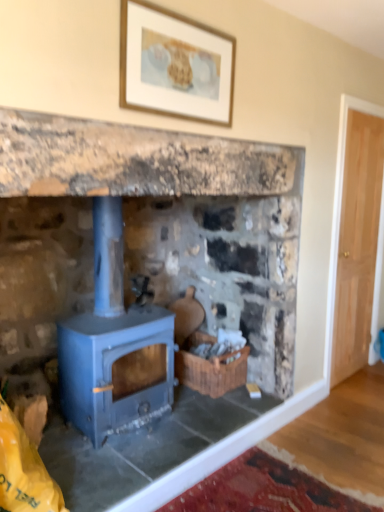
Identify the location of vacant area in front of blue matte wood burning stove at center. The width and height of the screenshot is (384, 512). (99, 463).